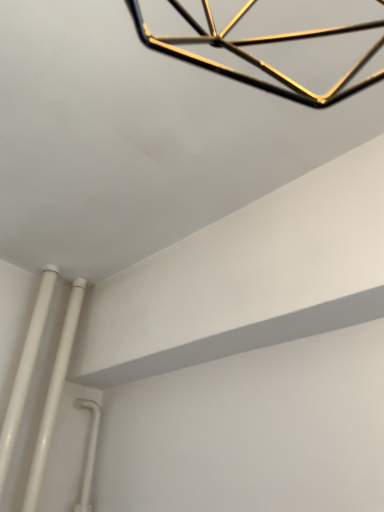
Question: Would you say white glossy pipe at lower left, which is counted as the second pipe, starting from the right, is a long distance from white glossy pipes at lower left, arranged as the 1th pipe when viewed from the right?

Choices:
 (A) no
 (B) yes

Answer: (A)

Question: From the image's perspective, is white glossy pipe at lower left, positioned as the first pipe in left-to-right order, over white glossy pipes at lower left, arranged as the 1th pipe when viewed from the right?

Choices:
 (A) yes
 (B) no

Answer: (A)

Question: Is white glossy pipe at lower left, positioned as the first pipe in left-to-right order, at the right side of white glossy pipes at lower left, which is counted as the second pipe, starting from the left?

Choices:
 (A) no
 (B) yes

Answer: (A)

Question: Does white glossy pipe at lower left, positioned as the first pipe in left-to-right order, lie behind white glossy pipes at lower left, arranged as the 1th pipe when viewed from the right?

Choices:
 (A) no
 (B) yes

Answer: (A)

Question: Considering the relative sizes of white glossy pipe at lower left, which is counted as the second pipe, starting from the right, and white glossy pipes at lower left, arranged as the 1th pipe when viewed from the right, in the image provided, is white glossy pipe at lower left, which is counted as the second pipe, starting from the right, taller than white glossy pipes at lower left, arranged as the 1th pipe when viewed from the right,?

Choices:
 (A) no
 (B) yes

Answer: (B)

Question: From the image's perspective, would you say white glossy pipe at lower left, positioned as the first pipe in left-to-right order, is shown under white glossy pipes at lower left, arranged as the 1th pipe when viewed from the right?

Choices:
 (A) no
 (B) yes

Answer: (A)

Question: Does white glossy pipes at lower left, arranged as the 1th pipe when viewed from the right, have a greater height compared to white glossy pipe at lower left, positioned as the first pipe in left-to-right order?

Choices:
 (A) yes
 (B) no

Answer: (B)

Question: From the image's perspective, would you say white glossy pipes at lower left, which is counted as the second pipe, starting from the left, is positioned over white glossy pipe at lower left, positioned as the first pipe in left-to-right order?

Choices:
 (A) yes
 (B) no

Answer: (B)

Question: Is white glossy pipes at lower left, which is counted as the second pipe, starting from the left, oriented away from white glossy pipe at lower left, which is counted as the second pipe, starting from the right?

Choices:
 (A) yes
 (B) no

Answer: (B)

Question: Does white glossy pipes at lower left, which is counted as the second pipe, starting from the left, have a lesser width compared to white glossy pipe at lower left, positioned as the first pipe in left-to-right order?

Choices:
 (A) no
 (B) yes

Answer: (A)

Question: Is white glossy pipes at lower left, which is counted as the second pipe, starting from the left, facing towards white glossy pipe at lower left, which is counted as the second pipe, starting from the right?

Choices:
 (A) yes
 (B) no

Answer: (B)

Question: Is white glossy pipes at lower left, arranged as the 1th pipe when viewed from the right, wider than white glossy pipe at lower left, which is counted as the second pipe, starting from the right?

Choices:
 (A) no
 (B) yes

Answer: (B)

Question: Is white glossy pipes at lower left, which is counted as the second pipe, starting from the left, to the left or to the right of white glossy pipe at lower left, which is counted as the second pipe, starting from the right, in the image?

Choices:
 (A) left
 (B) right

Answer: (B)